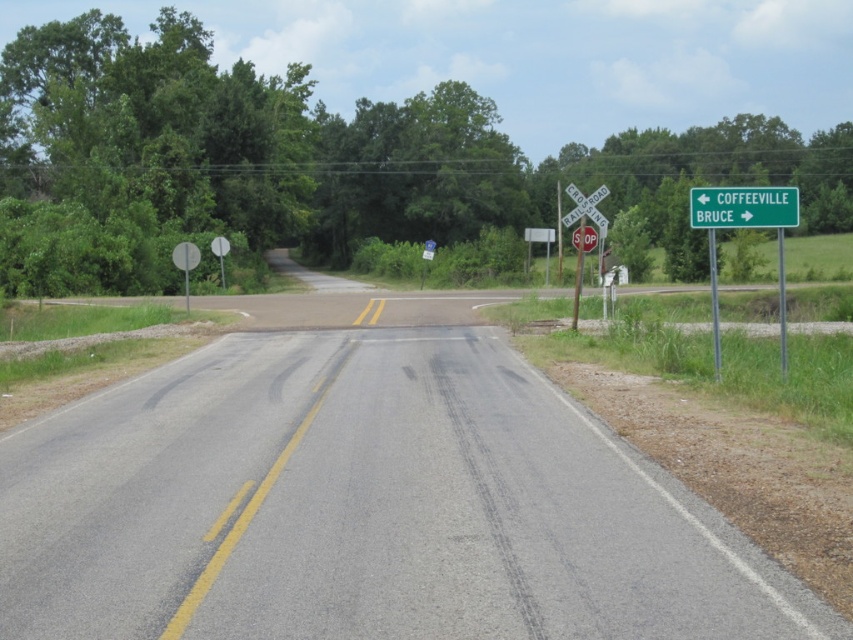
Question: Is asphalt road at center wider than green metallic sign at upper right?

Choices:
 (A) no
 (B) yes

Answer: (B)

Question: Which of the following is the closest to the observer?

Choices:
 (A) (689, 195)
 (B) (622, 540)

Answer: (B)

Question: Does asphalt road at center appear under green metallic sign at upper right?

Choices:
 (A) yes
 (B) no

Answer: (A)

Question: Can you confirm if asphalt road at center is bigger than green metallic sign at upper right?

Choices:
 (A) yes
 (B) no

Answer: (A)

Question: Among these points, which one is farthest from the camera?

Choices:
 (A) pyautogui.click(x=697, y=188)
 (B) pyautogui.click(x=369, y=417)

Answer: (A)